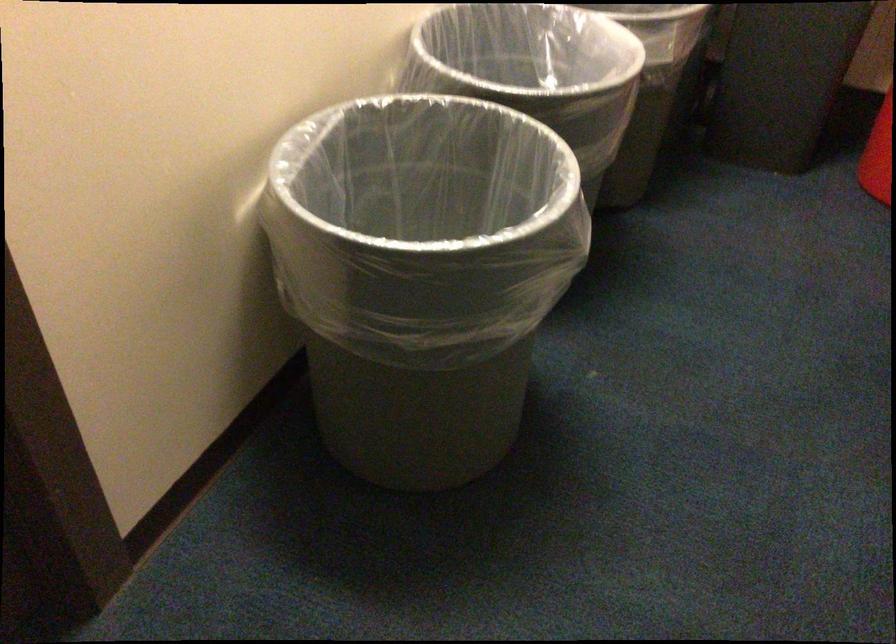
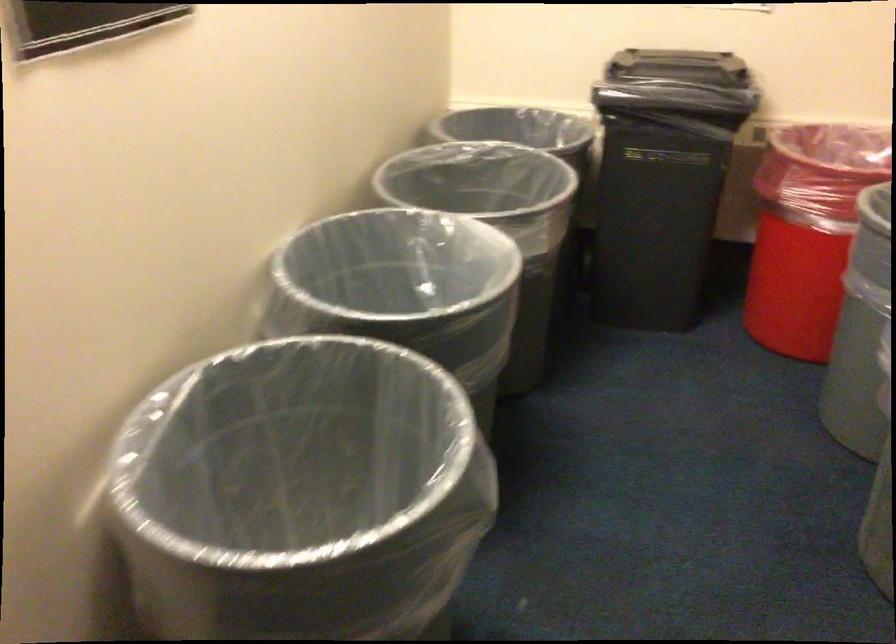
Question: In a continuous first-person perspective shot, in which direction is the camera moving?

Choices:
 (A) Left
 (B) Right
 (C) Forward
 (D) Backward

Answer: (C)